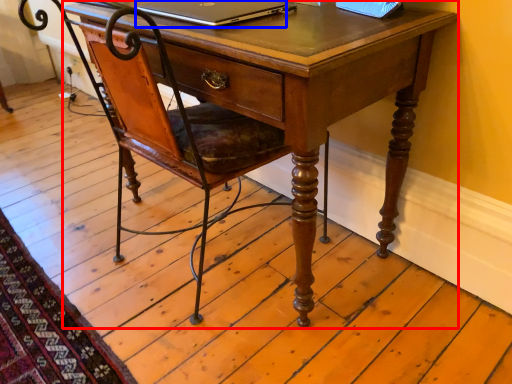
Question: Which object appears farthest to the camera in this image, desk (highlighted by a red box) or laptop (highlighted by a blue box)?

Choices:
 (A) desk
 (B) laptop

Answer: (B)